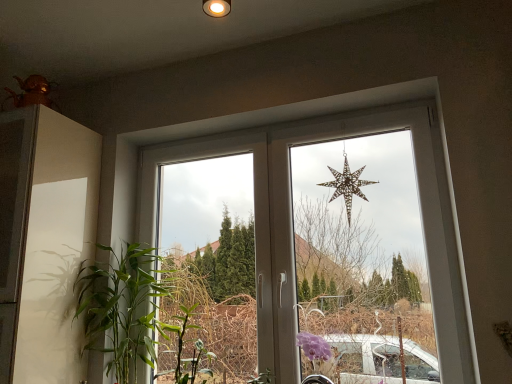
This screenshot has height=384, width=512. Describe the element at coordinates (293, 229) in the screenshot. I see `metallic star at center` at that location.

Image resolution: width=512 pixels, height=384 pixels. What are the coordinates of `metallic star at center` in the screenshot? It's located at pos(293,229).

From a real-world perspective, which is physically above, metallic gold star at upper center or green leafy plant at left?

From a 3D spatial view, metallic gold star at upper center is above.

Considering the positions of objects metallic gold star at upper center and green leafy plant at left in the image provided, who is more to the left, metallic gold star at upper center or green leafy plant at left?

From the viewer's perspective, green leafy plant at left appears more on the left side.

From the image's perspective, is metallic gold star at upper center on top of green leafy plant at left?

Yes.

Choose the correct answer: Is metallic gold star at upper center inside green leafy plant at left or outside it?

metallic gold star at upper center is spatially situated outside green leafy plant at left.

From the image's perspective, who appears lower, metallic gold star at upper center or metallic star at center?

metallic star at center appears lower in the image.

Would you say metallic gold star at upper center is inside or outside metallic star at center?

metallic gold star at upper center can be found inside metallic star at center.

From a real-world perspective, between metallic gold star at upper center and metallic star at center, who is vertically lower?

metallic star at center.

Is metallic gold star at upper center closer to camera compared to metallic star at center?

No, it is not.

Does green leafy plant at left touch metallic star at center?

No, green leafy plant at left is not with metallic star at center.

Is green leafy plant at left at the right side of metallic star at center?

No, green leafy plant at left is not to the right of metallic star at center.

Is green leafy plant at left further to camera compared to metallic star at center?

Yes, green leafy plant at left is further from the viewer.

From the image's perspective, does metallic star at center appear higher than green leafy plant at left?

Yes, from the image's perspective, metallic star at center is over green leafy plant at left.

From a real-world perspective, does metallic star at center stand above green leafy plant at left?

Yes, from a real-world perspective, metallic star at center is above green leafy plant at left.

Which object is more forward, metallic star at center or green leafy plant at left?

metallic star at center.

Is metallic star at center facing towards green leafy plant at left?

Yes, metallic star at center is aimed at green leafy plant at left.

Are green leafy plant at left and metallic gold star at upper center making contact?

There is a gap between green leafy plant at left and metallic gold star at upper center.

Which object is further away from the camera taking this photo, green leafy plant at left or metallic gold star at upper center?

metallic gold star at upper center.

Where is `houseplant in front of the metallic gold star at upper center`? The width and height of the screenshot is (512, 384). houseplant in front of the metallic gold star at upper center is located at coordinates (122, 308).

What's the angular difference between green leafy plant at left and metallic gold star at upper center's facing directions?

green leafy plant at left and metallic gold star at upper center are facing 0.23 degrees away from each other.

Which of these two, metallic star at center or metallic gold star at upper center, stands taller?

metallic star at center is taller.

From the image's perspective, is metallic star at center located above or below metallic gold star at upper center?

metallic star at center is below metallic gold star at upper center.

Between point (291, 327) and point (354, 182), which one is positioned behind?

The point (354, 182) is behind.

I want to click on houseplant below the metallic gold star at upper center (from a real-world perspective), so click(122, 308).

Identify the location of star on the right of the metallic star at center. (347, 185).

When comparing their distances from metallic star at center, does green leafy plant at left or metallic gold star at upper center seem further?

green leafy plant at left lies further to metallic star at center than the other object.

When comparing their distances from metallic star at center, does metallic gold star at upper center or green leafy plant at left seem closer?

Based on the image, metallic gold star at upper center appears to be nearer to metallic star at center.

Considering their positions, is metallic gold star at upper center positioned further to green leafy plant at left than metallic star at center?

metallic gold star at upper center.

Estimate the real-world distances between objects in this image. Which object is further from metallic gold star at upper center, metallic star at center or green leafy plant at left?

green leafy plant at left lies further to metallic gold star at upper center than the other object.

In the scene shown: Looking at the image, which one is located further to green leafy plant at left, metallic star at center or metallic gold star at upper center?

metallic gold star at upper center.

When comparing their distances from metallic gold star at upper center, does green leafy plant at left or metallic star at center seem closer?

Among the two, metallic star at center is located nearer to metallic gold star at upper center.

In order to click on window between green leafy plant at left and metallic gold star at upper center in the horizontal direction in this screenshot , I will do `click(293, 229)`.